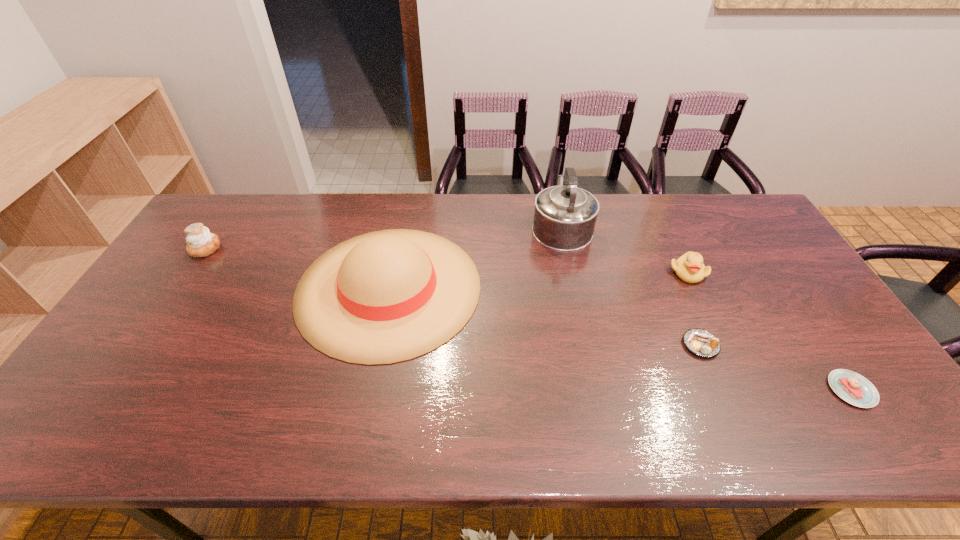
Identify the location of unoccupied position between the second farthest pastry and the tallest object. This screenshot has height=540, width=960. (631, 285).

At what (x,y) coordinates should I click in order to perform the action: click on vacant area between the sombrero and the leftmost pastry. Please return your answer as a coordinate pair (x, y). The width and height of the screenshot is (960, 540). Looking at the image, I should click on (297, 268).

This screenshot has height=540, width=960. What are the coordinates of `free spot between the kettle and the fifth object from right to left` in the screenshot? It's located at (475, 256).

What are the coordinates of `free spot between the rightmost object and the second tallest object` in the screenshot? It's located at (620, 339).

Identify the location of object that is the closest one to the second pastry from right to left. (689, 267).

Identify which object is the closest to the farthest pastry. Please provide its 2D coordinates. Your answer should be formatted as a tuple, i.e. [(x, y)], where the tuple contains the x and y coordinates of a point satisfying the conditions above.

[(386, 296)]

This screenshot has width=960, height=540. What are the coordinates of `the second closest pastry to the duckling` in the screenshot? It's located at (852, 387).

Locate an element on the screen. Image resolution: width=960 pixels, height=540 pixels. pastry that stands as the third closest to the kettle is located at coordinates (200, 242).

This screenshot has height=540, width=960. I want to click on vacant region that satisfies the following two spatial constraints: 1. on the front side of the second nearest pastry; 2. on the left side of the rightmost object, so click(720, 390).

I want to click on free spot that satisfies the following two spatial constraints: 1. at the face of the nearest object; 2. on the left side of the duckling, so click(x=744, y=390).